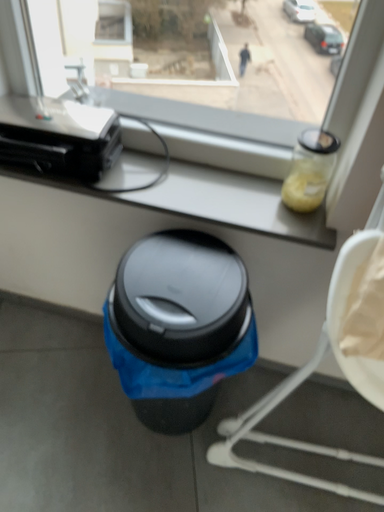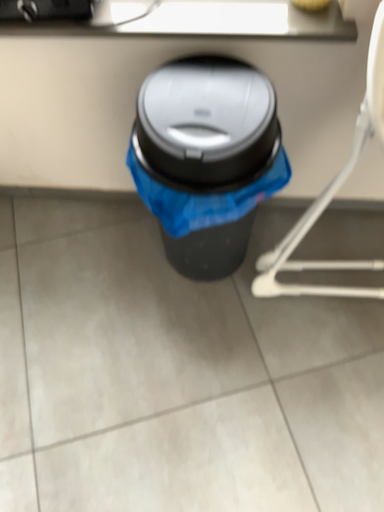
Question: How did the camera likely rotate when shooting the video?

Choices:
 (A) rotated upward
 (B) rotated downward

Answer: (B)